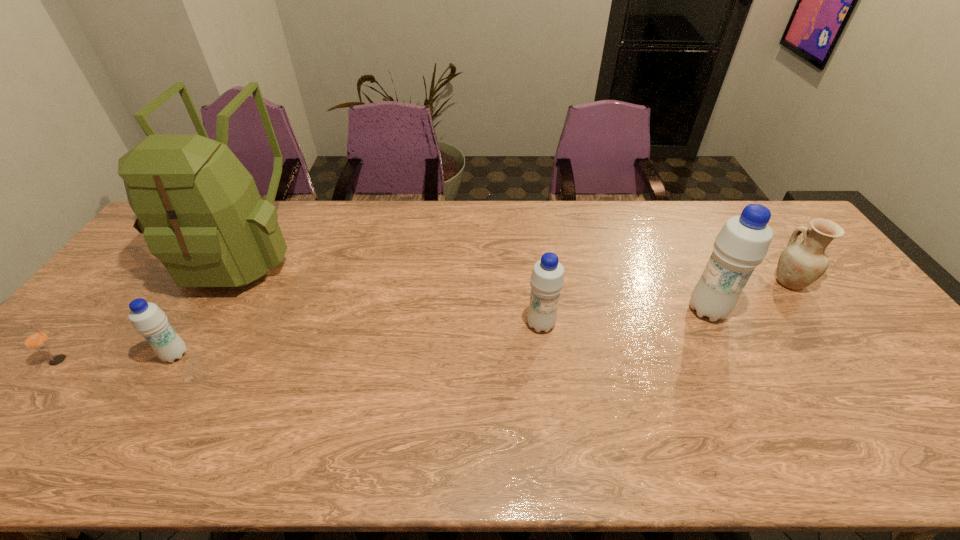
I want to click on free space that satisfies the following two spatial constraints: 1. on the front pocket of the second shortest water bottle; 2. on the left side of the backpack, so click(x=201, y=324).

Identify the location of free space that satisfies the following two spatial constraints: 1. on the back side of the second water bottle from left to right; 2. on the left side of the rightmost object. (536, 282).